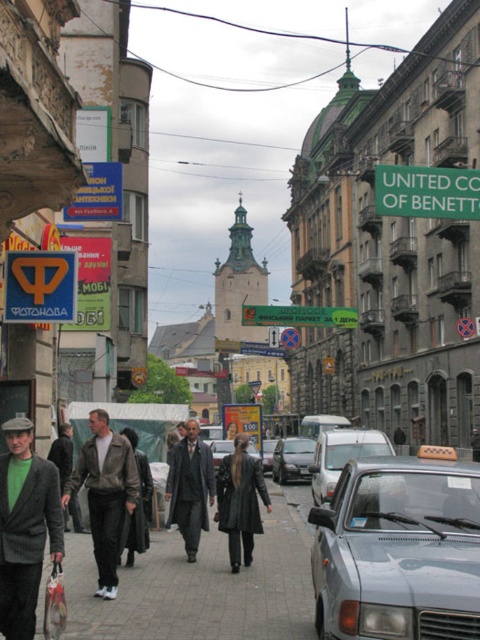
You are standing at the entrance of the street and want to walk to the paved stone sidewalk at center. According to the coordinates provided, in which direction should you move relative to your current position?

The paved stone sidewalk at center is located at coordinates point (201, 586), so you should move forward and to the right relative to your current position at the entrance.

You are a delivery person with a 1.2 meter wide cart. You need to navigate through the paved stone sidewalk at center where there is a dark gray leather coat at center. Can your cart pass through without touching the coat?

The paved stone sidewalk at center might be wider than dark gray leather coat at center, so there is a possibility that the cart can pass through without touching the coat, but the exact width isn not specified. Please proceed with caution.

You are standing on the street and want to reach the point at coordinates [169,618]. If your walking speed is 1.5 meters per second, how long will it take you to reach that point?

The point at coordinates [169,618] is 26.77 meters away from you. At a walking speed of 1.5 meters per second, it will take approximately 17.85 seconds to reach there.